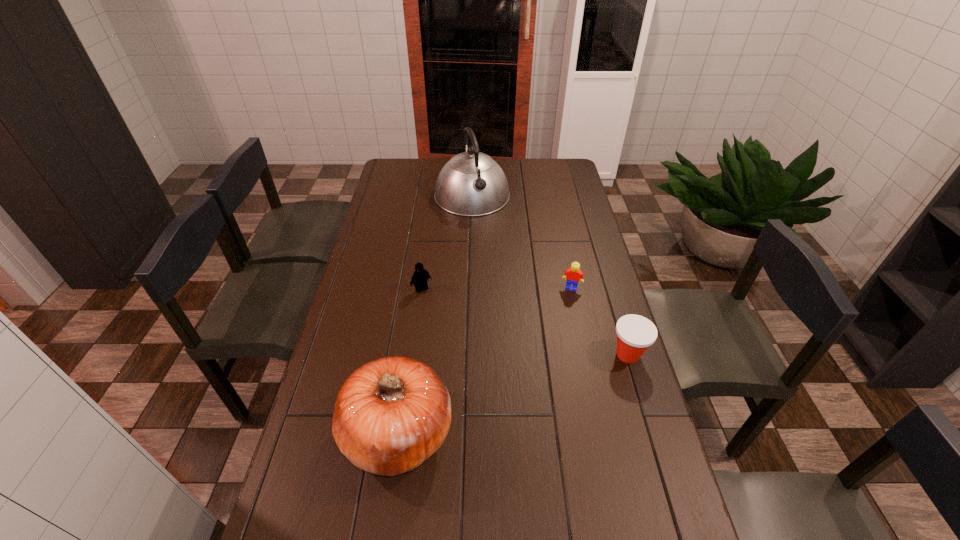
At what (x,y) coordinates should I click in order to perform the action: click on vacant space on the desktop that is between the second tallest object and the Dixie cup and is positioned on the face of the left Lego. Please return your answer as a coordinate pair (x, y). Looking at the image, I should click on (495, 400).

You are a GUI agent. You are given a task and a screenshot of the screen. Output one action in this format:
    pyautogui.click(x=<x>, y=<y>)
    Task: Click on the free space on the desktop that is between the nearest object and the fourth farthest object and is positioned on the front-facing side of the right Lego
    The width and height of the screenshot is (960, 540).
    Given the screenshot: What is the action you would take?
    pyautogui.click(x=552, y=380)

Locate an element on the screen. Image resolution: width=960 pixels, height=540 pixels. vacant space on the desktop that is between the pumpkin and the Dixie cup and is positioned from the spout of the farthest object is located at coordinates (549, 381).